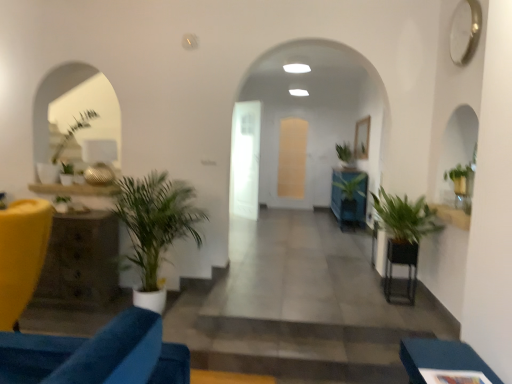
Question: Should I look upward or downward to see green matte plant at left, the first houseplant in the front-to-back sequence?

Choices:
 (A) down
 (B) up

Answer: (A)

Question: Considering the relative sizes of rustic wood side table at left, which is the second table in front-to-back order, and matte yellow chair at left, positioned as the first furniture in back-to-front order, in the image provided, is rustic wood side table at left, which is the second table in front-to-back order, shorter than matte yellow chair at left, positioned as the first furniture in back-to-front order,?

Choices:
 (A) no
 (B) yes

Answer: (B)

Question: Does rustic wood side table at left, which appears as the first table when viewed from the left, contain matte yellow chair at left, the 2th furniture viewed from the right?

Choices:
 (A) no
 (B) yes

Answer: (A)

Question: Can you see rustic wood side table at left, which is the second table in front-to-back order, touching matte yellow chair at left, the second furniture from the front?

Choices:
 (A) no
 (B) yes

Answer: (A)

Question: Is rustic wood side table at left, which is the second table in front-to-back order, further to camera compared to matte yellow chair at left, which ranks as the first furniture in left-to-right order?

Choices:
 (A) no
 (B) yes

Answer: (B)

Question: Does rustic wood side table at left, which appears as the first table when viewed from the left, have a greater width compared to matte yellow chair at left, the 2th furniture viewed from the right?

Choices:
 (A) yes
 (B) no

Answer: (A)

Question: From the image's perspective, is blue fabric ottoman at lower right, which ranks as the 2th furniture in left-to-right order, beneath black metal table at lower right, the first table when ordered from front to back?

Choices:
 (A) yes
 (B) no

Answer: (A)

Question: Can you confirm if blue fabric ottoman at lower right, positioned as the first furniture in front-to-back order, is shorter than black metal table at lower right, acting as the 2th table starting from the left?

Choices:
 (A) yes
 (B) no

Answer: (A)

Question: Is black metal table at lower right, placed as the first table when sorted from right to left, a part of blue fabric ottoman at lower right, positioned as the second furniture in back-to-front order?

Choices:
 (A) no
 (B) yes

Answer: (A)

Question: Is blue fabric ottoman at lower right, positioned as the second furniture in back-to-front order, oriented away from black metal table at lower right, the first table when ordered from front to back?

Choices:
 (A) no
 (B) yes

Answer: (A)

Question: Is blue fabric ottoman at lower right, positioned as the first furniture in front-to-back order, oriented towards black metal table at lower right, acting as the 2th table starting from the left?

Choices:
 (A) yes
 (B) no

Answer: (B)

Question: Is blue fabric ottoman at lower right, positioned as the first furniture in front-to-back order, in contact with black metal table at lower right, which ranks as the 2th table in back-to-front order?

Choices:
 (A) yes
 (B) no

Answer: (B)

Question: Is black metal table at lower right, acting as the 2th table starting from the left, thinner than rustic wood side table at left, which is the second table in front-to-back order?

Choices:
 (A) no
 (B) yes

Answer: (B)